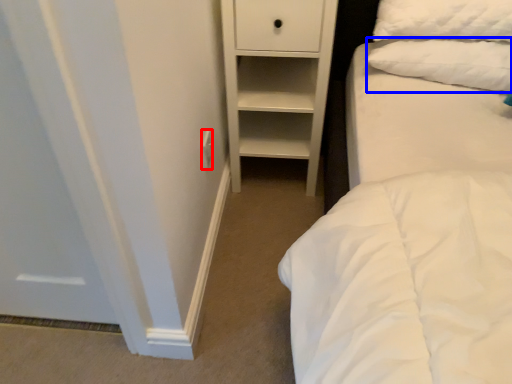
Question: Which of the following is the farthest to the observer, electric outlet (highlighted by a red box) or pillow (highlighted by a blue box)?

Choices:
 (A) electric outlet
 (B) pillow

Answer: (A)